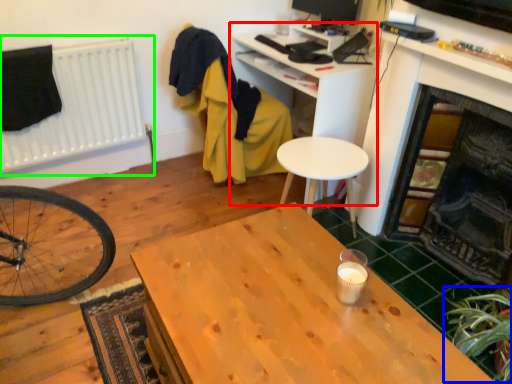
Question: Considering the real-world distances, which object is farthest from computer desk (highlighted by a red box)? plant (highlighted by a blue box) or radiator (highlighted by a green box)?

Choices:
 (A) plant
 (B) radiator

Answer: (A)